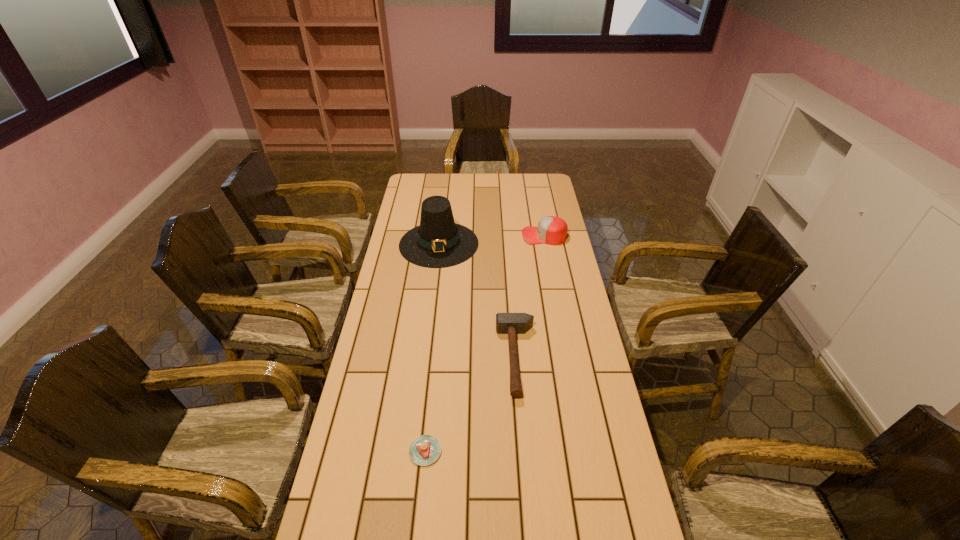
Locate an element on the screen. vacant space located on the striking surface of the second nearest object is located at coordinates [387, 358].

Identify the location of blank area located on the striking surface of the second nearest object. The height and width of the screenshot is (540, 960). (467, 358).

You are a GUI agent. You are given a task and a screenshot of the screen. Output one action in this format:
    pyautogui.click(x=<x>, y=<y>)
    Task: Click on the vacant space situated 0.130m on the striking surface of the second nearest object
    Image resolution: width=960 pixels, height=540 pixels.
    Given the screenshot: What is the action you would take?
    pyautogui.click(x=457, y=358)

Locate an element on the screen. blank area located 0.080m on the right of the pastry is located at coordinates (471, 451).

The image size is (960, 540). In order to click on object located in the left edge section of the desktop in this screenshot , I will do `click(438, 242)`.

This screenshot has width=960, height=540. Identify the location of object situated at the right edge. (552, 230).

Identify the location of free space at the left edge of the desktop. The width and height of the screenshot is (960, 540). (361, 384).

At what (x,y) coordinates should I click in order to perform the action: click on free space at the right edge. Please return your answer as a coordinate pair (x, y). Looking at the image, I should click on (567, 387).

The width and height of the screenshot is (960, 540). What are the coordinates of `free space between the hat and the third shortest object` in the screenshot? It's located at (492, 240).

At what (x,y) coordinates should I click in order to perform the action: click on empty space that is in between the baseball cap and the nearest object. Please return your answer as a coordinate pair (x, y). The width and height of the screenshot is (960, 540). Looking at the image, I should click on (485, 343).